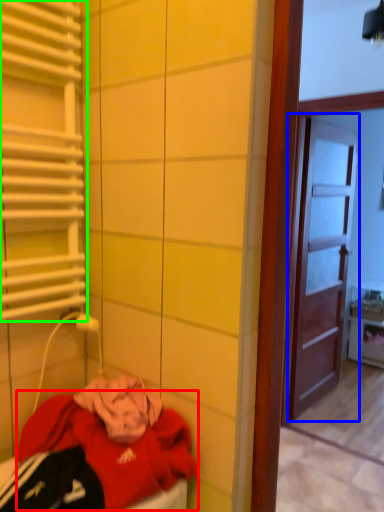
Question: Estimate the real-world distances between objects in this image. Which object is farther from clothing (highlighted by a red box), door (highlighted by a blue box) or shutter (highlighted by a green box)?

Choices:
 (A) door
 (B) shutter

Answer: (A)